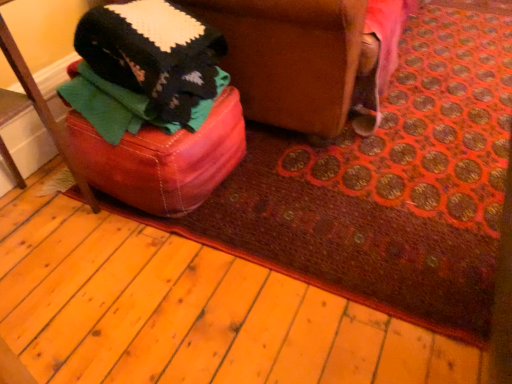
What is the approximate width of leather ottoman at left?

A: leather ottoman at left is 39.26 centimeters in width.

What do you see at coordinates (35, 108) in the screenshot? The height and width of the screenshot is (384, 512). I see `leather ottoman at left` at bounding box center [35, 108].

I want to click on leather ottoman at left, so coord(35,108).

In order to face leather ottoman at left, should I rotate leftwards or rightwards?

A 34.661 degree turn to the left will do.

Describe the element at coordinates (305, 56) in the screenshot. I see `leather ottoman at lower left` at that location.

Identify the location of leather ottoman at lower left. The image size is (512, 384). (305, 56).

Identify the location of leather ottoman at left. (35, 108).

Between leather ottoman at lower left and leather ottoman at left, which one appears on the left side from the viewer's perspective?

leather ottoman at left.

Is leather ottoman at lower left further to camera compared to leather ottoman at left?

Yes.

Does point (384, 39) come farther from viewer compared to point (24, 87)?

Yes, point (384, 39) is behind point (24, 87).

Consider the image. From the image's perspective, which object appears higher, leather ottoman at lower left or leather ottoman at left?

leather ottoman at lower left is shown above in the image.

In the scene shown: From a real-world perspective, relative to leather ottoman at left, is leather ottoman at lower left vertically above or below?

leather ottoman at lower left is situated lower than leather ottoman at left in the real world.

Which of these two, leather ottoman at lower left or leather ottoman at left, is wider?

leather ottoman at lower left is wider.

Does leather ottoman at lower left have a lesser height compared to leather ottoman at left?

Correct, leather ottoman at lower left is not as tall as leather ottoman at left.

Which of these two, leather ottoman at lower left or leather ottoman at left, is bigger?

With larger size is leather ottoman at lower left.

Is leather ottoman at lower left not within leather ottoman at left?

Yes, leather ottoman at lower left is not within leather ottoman at left.

Would you consider leather ottoman at lower left to be distant from leather ottoman at left?

That's not correct — leather ottoman at lower left is a little close to leather ottoman at left.

Does leather ottoman at lower left turn towards leather ottoman at left?

No, leather ottoman at lower left is not facing towards leather ottoman at left.

How many degrees apart are the facing directions of leather ottoman at lower left and leather ottoman at left?

leather ottoman at lower left and leather ottoman at left are facing 0.627 degrees away from each other.

The image size is (512, 384). Identify the location of furniture on the left of leather ottoman at lower left. (35, 108).

Considering the relative positions of leather ottoman at left and leather ottoman at lower left in the image provided, is leather ottoman at left to the right of leather ottoman at lower left from the viewer's perspective?

No.

Relative to leather ottoman at lower left, is leather ottoman at left in front or behind?

leather ottoman at left is positioned closer to the viewer than leather ottoman at lower left.

Which is in front, point (5, 32) or point (379, 40)?

Point (5, 32)

From the image's perspective, is leather ottoman at left located above or below leather ottoman at lower left?

Clearly, from the image's perspective, leather ottoman at left is below leather ottoman at lower left.

From a real-world perspective, is leather ottoman at left positioned above or below leather ottoman at lower left?

Clearly, from a real-world perspective, leather ottoman at left is above leather ottoman at lower left.

Is leather ottoman at left wider or thinner than leather ottoman at lower left?

Clearly, leather ottoman at left has less width compared to leather ottoman at lower left.

Can you confirm if leather ottoman at left is taller than leather ottoman at lower left?

Yes, leather ottoman at left is taller than leather ottoman at lower left.

Between leather ottoman at left and leather ottoman at lower left, which one has smaller size?

leather ottoman at left.

Is leather ottoman at left spatially inside leather ottoman at lower left, or outside of it?

leather ottoman at left is located beyond the bounds of leather ottoman at lower left.

Is leather ottoman at left positioned far away from leather ottoman at lower left?

No.

Is leather ottoman at left turned away from leather ottoman at lower left?

leather ottoman at left is not turned away from leather ottoman at lower left.

How different are the orientations of leather ottoman at left and leather ottoman at lower left in degrees?

There is a 0.627-degree angle between the facing directions of leather ottoman at left and leather ottoman at lower left.

Where is `furniture below the leather ottoman at lower left (from the image's perspective)`? The image size is (512, 384). furniture below the leather ottoman at lower left (from the image's perspective) is located at coordinates (35, 108).

Where is `furniture in front of the leather ottoman at lower left`? This screenshot has width=512, height=384. furniture in front of the leather ottoman at lower left is located at coordinates (35, 108).

At what (x,y) coordinates should I click in order to perform the action: click on swivel chair on the right of leather ottoman at left. Please return your answer as a coordinate pair (x, y). The height and width of the screenshot is (384, 512). Looking at the image, I should click on (305, 56).